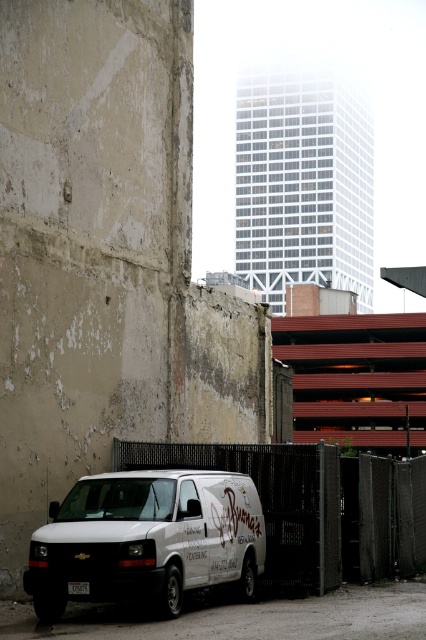
You are standing at the point marked by the coordinates (146,540) in the image. Based on the scene described, what object are you most likely standing on or near?

You are most likely standing on or near the white matte van at lower left, as the coordinates point (146,540) corresponds to that object.